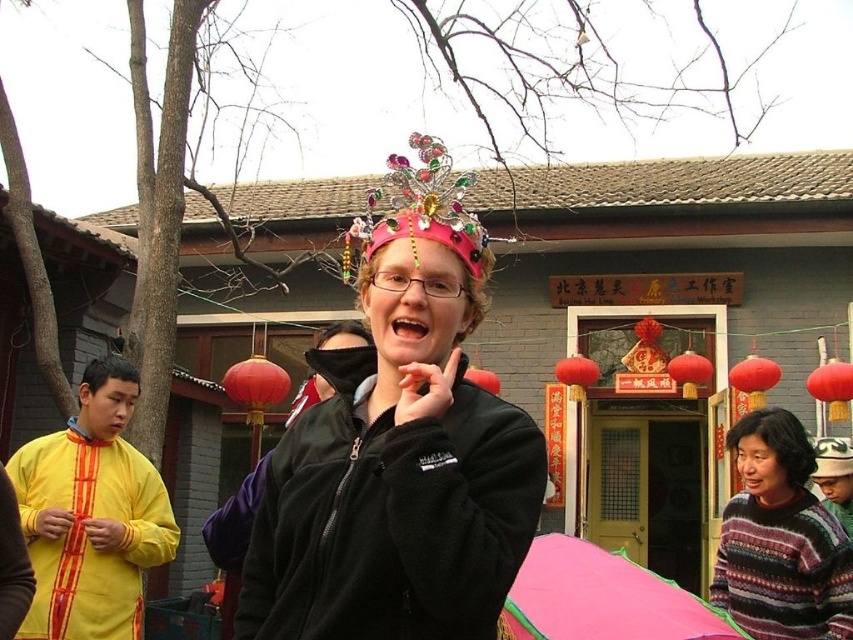
Is pink fabric crown at center further to camera compared to yellow fabric head at left?

No, pink fabric crown at center is closer to the viewer.

Where is `pink fabric crown at center`? pink fabric crown at center is located at coordinates (419, 209).

Which is in front, point (769, 477) or point (357, 333)?

Point (769, 477) is more forward.

Find the location of a particular element. matte black sweater at lower right is located at coordinates (770, 454).

Find the location of `matte black sweater at lower right`. matte black sweater at lower right is located at coordinates tap(770, 454).

Who is shorter, matte black sweater at lower right or yellow fabric head at left?

yellow fabric head at left

Which is in front, point (737, 460) or point (132, 403)?

Point (737, 460)

Find the location of a particular element. matte black sweater at lower right is located at coordinates (770, 454).